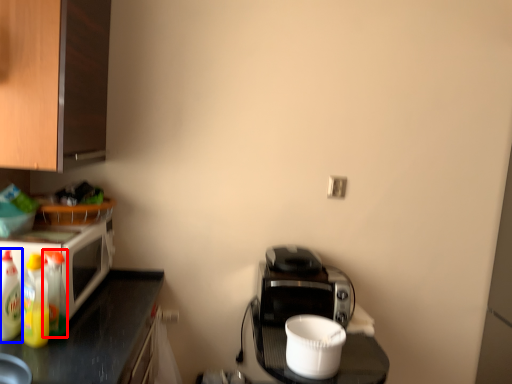
Question: Which of the following is the farthest to the observer, bottle (highlighted by a red box) or bottle (highlighted by a blue box)?

Choices:
 (A) bottle
 (B) bottle

Answer: (A)